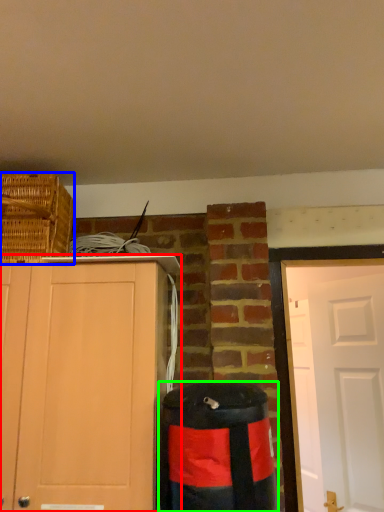
Question: Considering the real-world distances, which object is closest to cabinetry (highlighted by a red box)? basket (highlighted by a blue box) or waste container (highlighted by a green box).

Choices:
 (A) basket
 (B) waste container

Answer: (B)